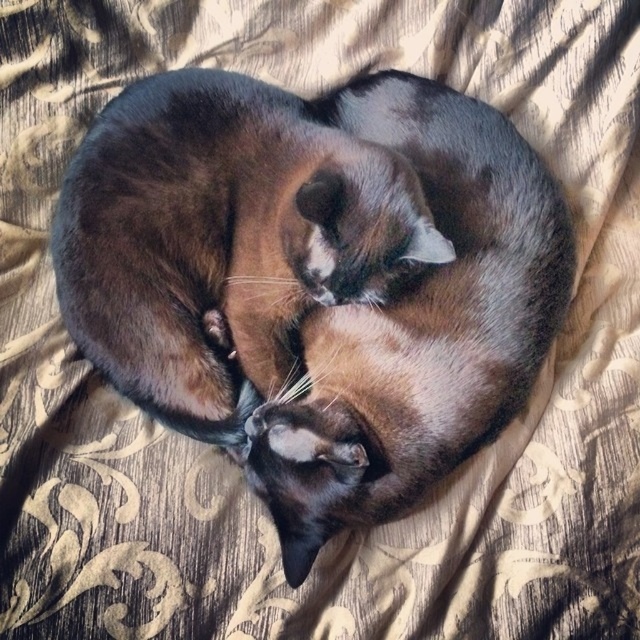
Question: Does shiny black cat at center lie in front of shiny brown cat at center?

Choices:
 (A) yes
 (B) no

Answer: (A)

Question: Which of the following is the farthest from the observer?

Choices:
 (A) (314, 497)
 (B) (172, 275)

Answer: (B)

Question: Does shiny black cat at center appear on the left side of shiny brown cat at center?

Choices:
 (A) no
 (B) yes

Answer: (B)

Question: Is shiny black cat at center closer to the viewer compared to shiny brown cat at center?

Choices:
 (A) yes
 (B) no

Answer: (A)